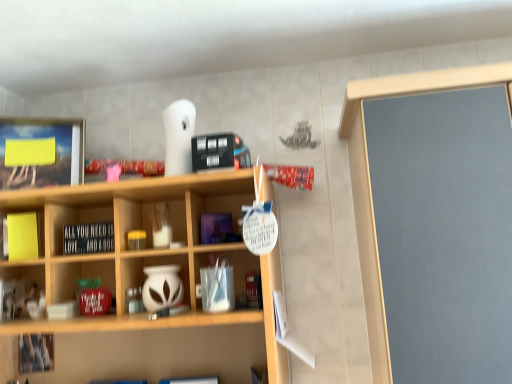
Question: Are black matte signboard at center and yellow matte sticky notes at left, the 1th cabinet from the left, far apart?

Choices:
 (A) no
 (B) yes

Answer: (A)

Question: Is black matte signboard at center located outside yellow matte sticky notes at left, which is counted as the 1th cabinet, starting from the top?

Choices:
 (A) yes
 (B) no

Answer: (A)

Question: Can you confirm if black matte signboard at center is positioned to the left of yellow matte sticky notes at left, the second cabinet positioned from the bottom?

Choices:
 (A) no
 (B) yes

Answer: (A)

Question: Considering the relative sizes of black matte signboard at center and yellow matte sticky notes at left, placed as the second cabinet when sorted from right to left, in the image provided, is black matte signboard at center shorter than yellow matte sticky notes at left, placed as the second cabinet when sorted from right to left,?

Choices:
 (A) yes
 (B) no

Answer: (A)

Question: Does black matte signboard at center have a smaller size compared to yellow matte sticky notes at left, placed as the second cabinet when sorted from right to left?

Choices:
 (A) no
 (B) yes

Answer: (A)

Question: Relative to yellow matte sticky notes at left, which is counted as the 1th cabinet, starting from the top, is white matte vase at center, which is the 1th cabinet in bottom-to-top order, in front or behind?

Choices:
 (A) front
 (B) behind

Answer: (A)

Question: In terms of width, does white matte vase at center, which is the 1th cabinet in bottom-to-top order, look wider or thinner when compared to yellow matte sticky notes at left, the 1th cabinet from the left?

Choices:
 (A) wide
 (B) thin

Answer: (A)

Question: From their relative heights in the image, would you say white matte vase at center, which is the 1th cabinet in bottom-to-top order, is taller or shorter than yellow matte sticky notes at left, the 1th cabinet from the left?

Choices:
 (A) short
 (B) tall

Answer: (A)

Question: Would you say white matte vase at center, which is the second cabinet in left-to-right order, is to the left or to the right of yellow matte sticky notes at left, the second cabinet positioned from the bottom, in the picture?

Choices:
 (A) right
 (B) left

Answer: (A)

Question: Is point (174, 273) closer or farther from the camera than point (92, 230)?

Choices:
 (A) farther
 (B) closer

Answer: (B)

Question: From a real-world perspective, is white matte vase at center, which is the second cabinet in top-to-bottom order, positioned above or below black matte signboard at center?

Choices:
 (A) below
 (B) above

Answer: (A)

Question: Is white matte vase at center, which is the 1th cabinet in bottom-to-top order, taller or shorter than black matte signboard at center?

Choices:
 (A) short
 (B) tall

Answer: (B)

Question: Do you think white matte vase at center, which is the second cabinet in left-to-right order, is within black matte signboard at center, or outside of it?

Choices:
 (A) outside
 (B) inside

Answer: (A)

Question: From the image's perspective, is yellow matte sticky notes at left, the second cabinet positioned from the bottom, positioned above or below black matte signboard at center?

Choices:
 (A) below
 (B) above

Answer: (B)

Question: From a real-world perspective, is yellow matte sticky notes at left, which is counted as the 1th cabinet, starting from the top, above or below black matte signboard at center?

Choices:
 (A) above
 (B) below

Answer: (A)